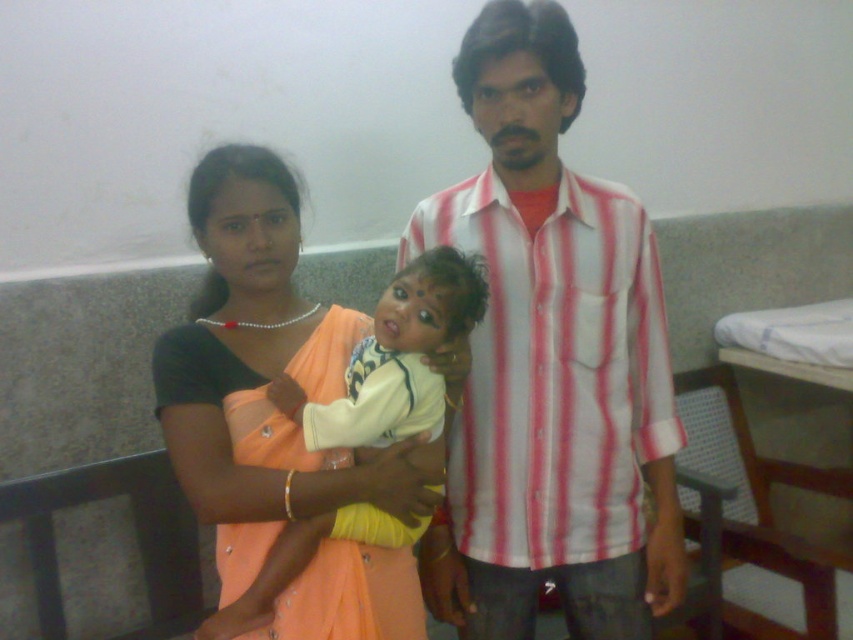
You are a photographer adjusting the lighting in the room. You need to ensure that both the striped cotton shirt at center and the matte orange sari at center are well lit. Given their sizes, which object should you focus more light on to ensure proper exposure?

The striped cotton shirt at center has a larger width than the matte orange sari at center, so you should focus more light on the striped cotton shirt at center to ensure proper exposure.

You are a nurse standing 5 feet away from the striped cotton shirt at center. Can you reach it without moving?

The striped cotton shirt at center is 4.32 feet away from the viewer. Since you are 5 feet away, you cannot reach it without moving closer.

You are a photographer setting up a shoot in a hospital room. You need to determine which of the two central items, the striped cotton shirt at center or the matte orange sari at center, requires more space to hang properly. Based on the scene description, which one should you allocate more space for?

The striped cotton shirt at center is bigger than the matte orange sari at center, so you should allocate more space for the striped cotton shirt at center to hang properly.